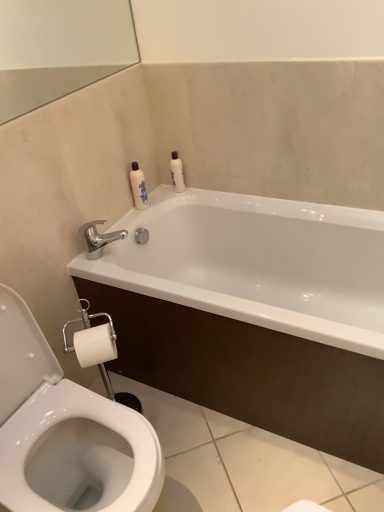
Identify the location of free space that is in between white glossy bottle at upper center, the 2th toiletry in the right-to-left sequence, and white glossy bottle at upper right, arranged as the first toiletry when viewed from the right. This screenshot has height=512, width=384. (170, 195).